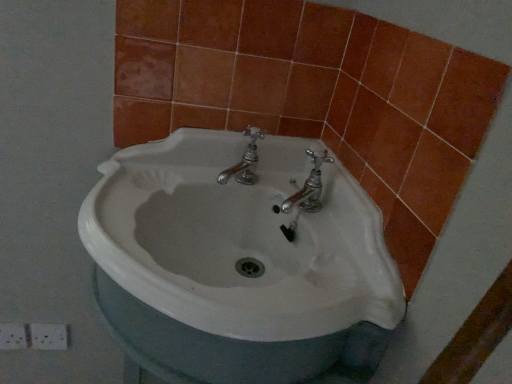
Question: Is orange ceramic tile at lower left, which ranks as the first ceramic tile in right-to-left order, to the right of orange matte tile at upper right, positioned as the first ceramic tile in left-to-right order, from the viewer's perspective?

Choices:
 (A) no
 (B) yes

Answer: (B)

Question: Considering the relative sizes of orange ceramic tile at lower left, which ranks as the first ceramic tile in right-to-left order, and orange matte tile at upper right, positioned as the first ceramic tile in left-to-right order, in the image provided, is orange ceramic tile at lower left, which ranks as the first ceramic tile in right-to-left order, wider than orange matte tile at upper right, positioned as the first ceramic tile in left-to-right order,?

Choices:
 (A) yes
 (B) no

Answer: (B)

Question: From the image's perspective, is orange ceramic tile at lower left, acting as the second ceramic tile starting from the left, located beneath orange matte tile at upper right, which is the second ceramic tile in right-to-left order?

Choices:
 (A) no
 (B) yes

Answer: (B)

Question: Is orange matte tile at upper right, which is the second ceramic tile in right-to-left order, surrounded by orange ceramic tile at lower left, acting as the second ceramic tile starting from the left?

Choices:
 (A) yes
 (B) no

Answer: (B)

Question: From a real-world perspective, is orange ceramic tile at lower left, which ranks as the first ceramic tile in right-to-left order, on orange matte tile at upper right, which is the second ceramic tile in right-to-left order?

Choices:
 (A) yes
 (B) no

Answer: (A)

Question: Does point (6, 337) appear closer or farther from the camera than point (125, 177)?

Choices:
 (A) closer
 (B) farther

Answer: (B)

Question: Considering the positions of orange matte tile at upper right, which is the second ceramic tile in right-to-left order, and white ceramic sink at center in the image, is orange matte tile at upper right, which is the second ceramic tile in right-to-left order, wider or thinner than white ceramic sink at center?

Choices:
 (A) thin
 (B) wide

Answer: (A)

Question: In terms of height, does orange matte tile at upper right, positioned as the first ceramic tile in left-to-right order, look taller or shorter compared to white ceramic sink at center?

Choices:
 (A) short
 (B) tall

Answer: (A)

Question: Is orange matte tile at upper right, which is the second ceramic tile in right-to-left order, to the left or to the right of white ceramic sink at center in the image?

Choices:
 (A) right
 (B) left

Answer: (B)

Question: Does point (33, 342) appear closer or farther from the camera than point (18, 344)?

Choices:
 (A) farther
 (B) closer

Answer: (B)

Question: Do you think orange ceramic tile at lower left, acting as the second ceramic tile starting from the left, is within orange matte tile at upper right, positioned as the first ceramic tile in left-to-right order, or outside of it?

Choices:
 (A) outside
 (B) inside

Answer: (A)

Question: From the image's perspective, is orange ceramic tile at lower left, acting as the second ceramic tile starting from the left, located above or below orange matte tile at upper right, which is the second ceramic tile in right-to-left order?

Choices:
 (A) below
 (B) above

Answer: (A)

Question: Is orange ceramic tile at lower left, which ranks as the first ceramic tile in right-to-left order, to the left or to the right of orange matte tile at upper right, positioned as the first ceramic tile in left-to-right order, in the image?

Choices:
 (A) right
 (B) left

Answer: (A)

Question: From the image's perspective, relative to orange ceramic tile at lower left, acting as the second ceramic tile starting from the left, is orange matte tile at upper right, which is the second ceramic tile in right-to-left order, above or below?

Choices:
 (A) below
 (B) above

Answer: (B)

Question: From a real-world perspective, is orange matte tile at upper right, which is the second ceramic tile in right-to-left order, above or below orange ceramic tile at lower left, acting as the second ceramic tile starting from the left?

Choices:
 (A) below
 (B) above

Answer: (A)